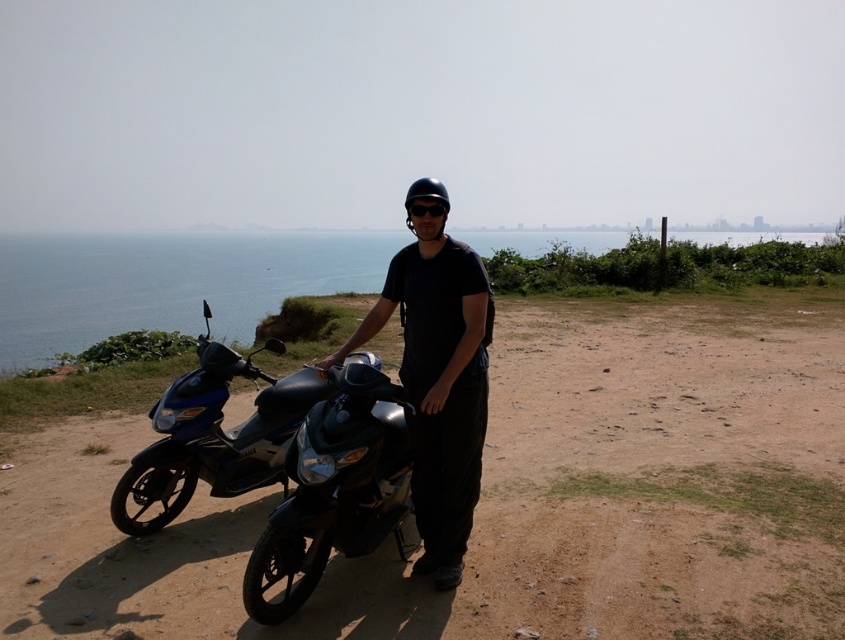
You are a photographer planning to take a photo of the black glossy motorcycle at center and the blue glossy scooter at left. Since you want to ensure both are in focus, you need to know their sizes relative to each other. Which one is larger?

The black glossy motorcycle at center is bigger than the blue glossy scooter at left, so the photographer should adjust the camera settings to account for the size difference to ensure both are in focus.